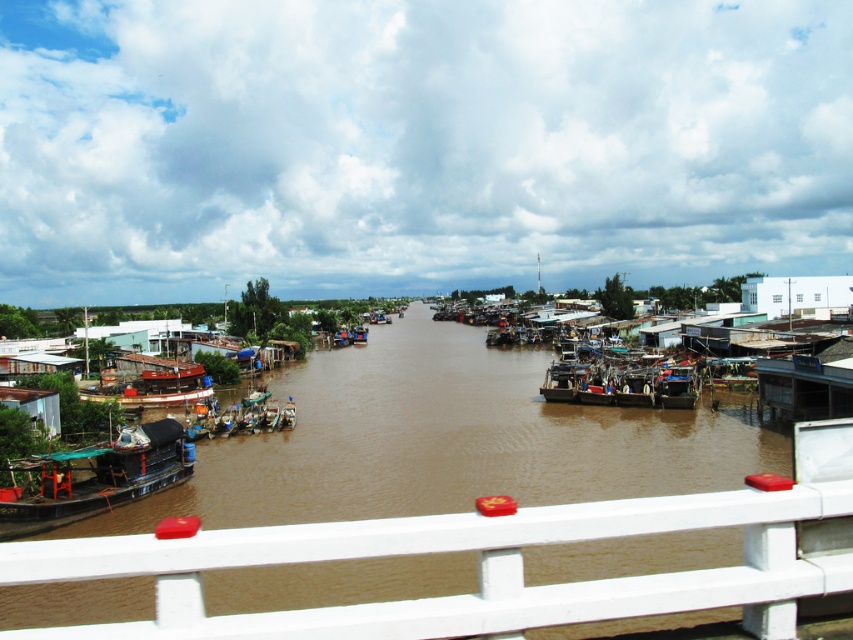
Question: Among these points, which one is farthest from the camera?

Choices:
 (A) (68, 486)
 (B) (543, 476)
 (C) (575, 392)

Answer: (C)

Question: Observing the image, what is the correct spatial positioning of brown matte river at center in reference to wooden boat at center?

Choices:
 (A) right
 (B) left

Answer: (B)

Question: Can you confirm if brown matte river at center is smaller than green matte boat at lower left?

Choices:
 (A) yes
 (B) no

Answer: (B)

Question: Estimate the real-world distances between objects in this image. Which object is closer to the green matte boat at lower left?

Choices:
 (A) brown matte river at center
 (B) white painted metal rail at lower center
 (C) wooden boat at center

Answer: (A)

Question: Which point appears farthest from the camera in this image?

Choices:
 (A) (653, 372)
 (B) (334, 378)
 (C) (840, 481)

Answer: (B)

Question: Is brown matte river at center thinner than green matte boat at lower left?

Choices:
 (A) yes
 (B) no

Answer: (B)